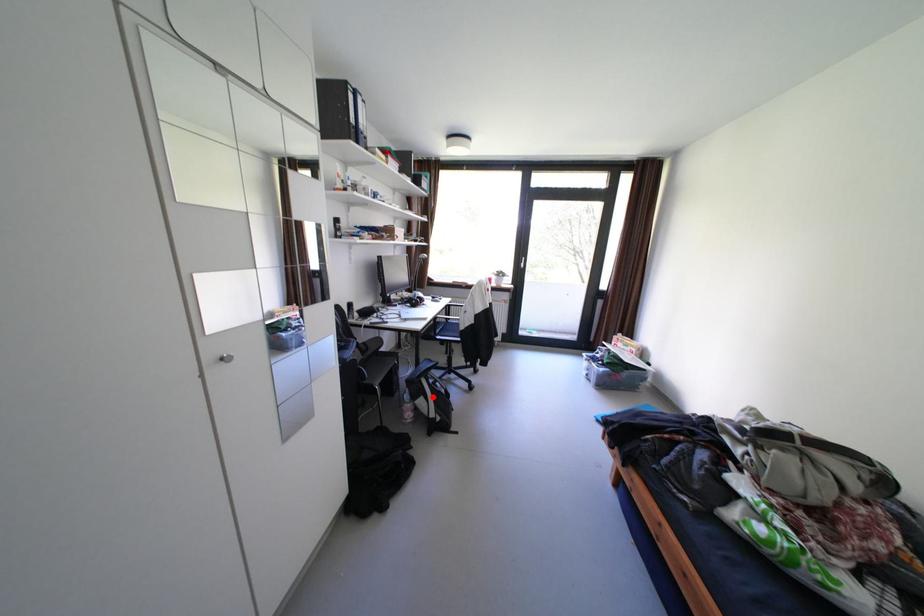
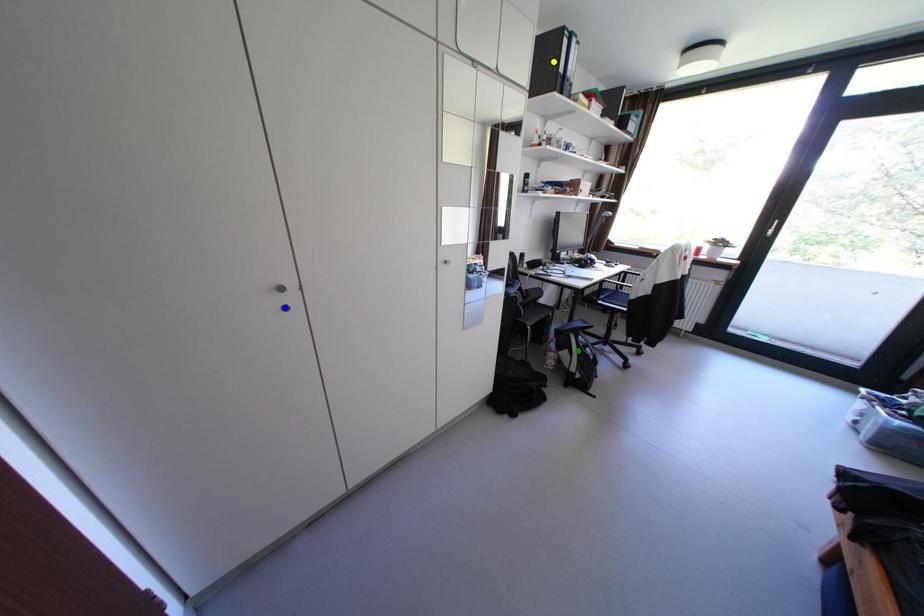
Question: I am providing you with two images of the same scene from different viewpoints. A red point is marked on the first image. You are given multiple points on the second image. Which point in image 2 is actually the same real-world point as the red point in image 1?

Choices:
 (A) yellow point
 (B) blue point
 (C) green point

Answer: (C)